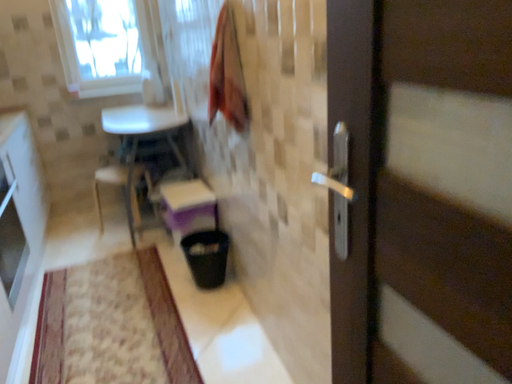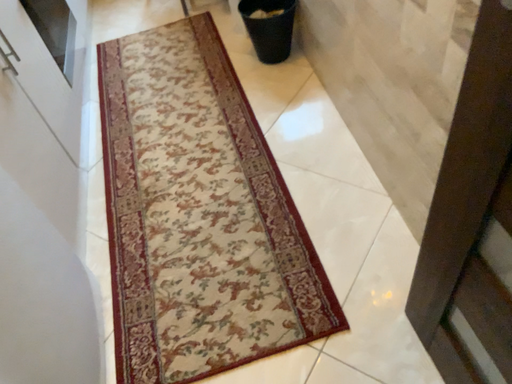
Question: Which way did the camera rotate in the video?

Choices:
 (A) rotated right
 (B) rotated left

Answer: (B)